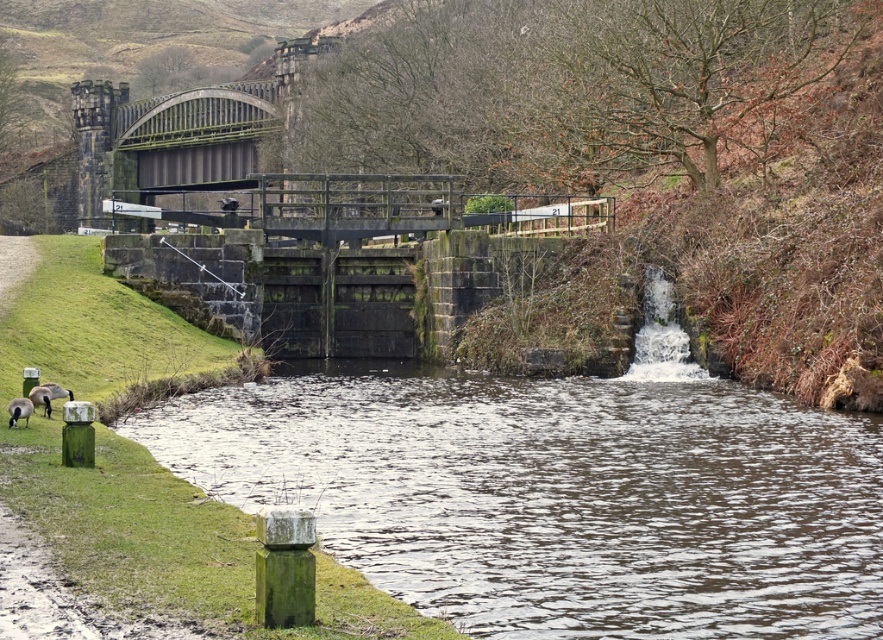
You are standing at the edge of the canal lock system and want to reach a specific point marked at coordinates point (553,442). If you can walk 120 feet in 5 minutes, will you be able to reach that point within that time?

The distance of point (553,442) from viewer is 118.77 feet. Since you can walk 120 feet in 5 minutes, you can reach the point within that time as 118.77 feet is less than 120 feet.